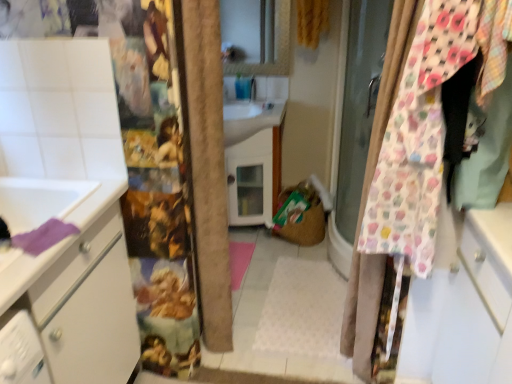
Question: Is floral fabric curtain at right, marked as the second curtain in a top-to-bottom arrangement, oriented away from white glossy sink at center?

Choices:
 (A) yes
 (B) no

Answer: (B)

Question: Considering the relative positions of floral fabric curtain at right, the second curtain when ordered from back to front, and white glossy sink at center in the image provided, is floral fabric curtain at right, the second curtain when ordered from back to front, to the right of white glossy sink at center from the viewer's perspective?

Choices:
 (A) no
 (B) yes

Answer: (B)

Question: Is floral fabric curtain at right, the first curtain from the front, thinner than white glossy sink at center?

Choices:
 (A) no
 (B) yes

Answer: (B)

Question: Is floral fabric curtain at right, placed as the first curtain when sorted from bottom to top, to the left of white glossy sink at center from the viewer's perspective?

Choices:
 (A) no
 (B) yes

Answer: (A)

Question: Is floral fabric curtain at right, the first curtain from the front, closer to the viewer compared to white glossy sink at center?

Choices:
 (A) no
 (B) yes

Answer: (B)

Question: From the image's perspective, relative to floral fabric curtain at right, the second curtain when ordered from back to front, is yellow textured curtain at upper center, the first curtain viewed from the back, above or below?

Choices:
 (A) above
 (B) below

Answer: (A)

Question: In terms of width, does yellow textured curtain at upper center, which appears as the 2th curtain when viewed from the front, look wider or thinner when compared to floral fabric curtain at right, the second curtain when ordered from back to front?

Choices:
 (A) wide
 (B) thin

Answer: (A)

Question: In terms of height, does yellow textured curtain at upper center, the 2th curtain from the bottom, look taller or shorter compared to floral fabric curtain at right, marked as the second curtain in a top-to-bottom arrangement?

Choices:
 (A) tall
 (B) short

Answer: (B)

Question: Is yellow textured curtain at upper center, the 2th curtain from the bottom, spatially inside floral fabric curtain at right, marked as the second curtain in a top-to-bottom arrangement, or outside of it?

Choices:
 (A) inside
 (B) outside

Answer: (B)

Question: Would you say floral fabric curtain at right, placed as the first curtain when sorted from bottom to top, is inside or outside white glossy sink at center?

Choices:
 (A) outside
 (B) inside

Answer: (A)

Question: Relative to white glossy sink at center, is floral fabric curtain at right, marked as the second curtain in a top-to-bottom arrangement, in front or behind?

Choices:
 (A) front
 (B) behind

Answer: (A)

Question: Considering the positions of point (389, 211) and point (224, 142), is point (389, 211) closer or farther from the camera than point (224, 142)?

Choices:
 (A) farther
 (B) closer

Answer: (B)

Question: From the image's perspective, relative to white glossy sink at center, is floral fabric curtain at right, the second curtain when ordered from back to front, above or below?

Choices:
 (A) below
 (B) above

Answer: (A)

Question: From a real-world perspective, is white glossy sink at center above or below floral fabric curtain at right, placed as the first curtain when sorted from bottom to top?

Choices:
 (A) above
 (B) below

Answer: (B)

Question: From their relative heights in the image, would you say white glossy sink at center is taller or shorter than floral fabric curtain at right, the second curtain when ordered from back to front?

Choices:
 (A) short
 (B) tall

Answer: (A)